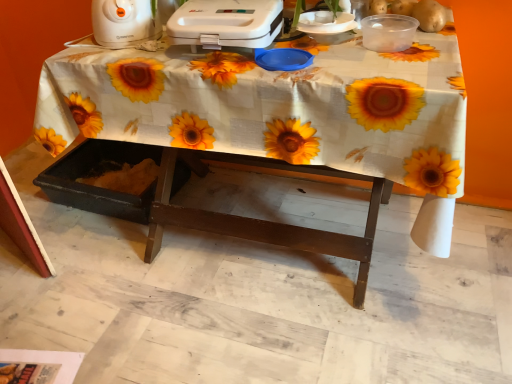
Consider the image. What is the approximate height of white fabric-covered table at center?

The height of white fabric-covered table at center is 26.38 inches.

The width and height of the screenshot is (512, 384). I want to click on white plastic toaster at upper left, positioned as the first appliance in left-to-right order, so click(123, 23).

Where is `white plastic toaster at upper center, the 1th appliance in the right-to-left sequence`? The height and width of the screenshot is (384, 512). white plastic toaster at upper center, the 1th appliance in the right-to-left sequence is located at coordinates 226,23.

From the image's perspective, would you say white plastic toaster at upper center, which is the 2th appliance from left to right, is positioned over white plastic toaster at upper left, positioned as the first appliance in left-to-right order?

No.

Considering the sizes of white plastic toaster at upper center, the 1th appliance in the right-to-left sequence, and white plastic toaster at upper left, positioned as the first appliance in left-to-right order, in the image, is white plastic toaster at upper center, the 1th appliance in the right-to-left sequence, taller or shorter than white plastic toaster at upper left, positioned as the first appliance in left-to-right order,?

white plastic toaster at upper center, the 1th appliance in the right-to-left sequence, is shorter than white plastic toaster at upper left, positioned as the first appliance in left-to-right order.

Is white plastic toaster at upper center, which is the 2th appliance from left to right, closer to camera compared to white plastic toaster at upper left, arranged as the 2th appliance when viewed from the right?

Yes, the depth of white plastic toaster at upper center, which is the 2th appliance from left to right, is less than that of white plastic toaster at upper left, arranged as the 2th appliance when viewed from the right.

Are white plastic toaster at upper center, which is the 2th appliance from left to right, and white plastic toaster at upper left, positioned as the first appliance in left-to-right order, located far from each other?

They are positioned close to each other.

Is the depth of white plastic toaster at upper left, positioned as the first appliance in left-to-right order, greater than that of white plastic toaster at upper center, which is the 2th appliance from left to right?

Yes, it is behind white plastic toaster at upper center, which is the 2th appliance from left to right.

Is point (134, 41) positioned behind point (234, 46)?

Yes, point (134, 41) is behind point (234, 46).

How much distance is there between white plastic toaster at upper left, arranged as the 2th appliance when viewed from the right, and white plastic toaster at upper center, which is the 2th appliance from left to right?

white plastic toaster at upper left, arranged as the 2th appliance when viewed from the right, and white plastic toaster at upper center, which is the 2th appliance from left to right, are 7.42 inches apart from each other.

Can you see white plastic toaster at upper left, arranged as the 2th appliance when viewed from the right, touching white plastic toaster at upper center, which is the 2th appliance from left to right?

There is a gap between white plastic toaster at upper left, arranged as the 2th appliance when viewed from the right, and white plastic toaster at upper center, which is the 2th appliance from left to right.

Is white fabric-covered table at center closer to the viewer compared to white plastic toaster at upper center, the 1th appliance in the right-to-left sequence?

Yes, it is.

From a real-world perspective, between white fabric-covered table at center and white plastic toaster at upper center, the 1th appliance in the right-to-left sequence, who is vertically higher?

white plastic toaster at upper center, the 1th appliance in the right-to-left sequence, from a real-world perspective.

Is white fabric-covered table at center beside white plastic toaster at upper center, which is the 2th appliance from left to right?

No, white fabric-covered table at center is not with white plastic toaster at upper center, which is the 2th appliance from left to right.

In terms of width, does white plastic toaster at upper center, the 1th appliance in the right-to-left sequence, look wider or thinner when compared to white fabric-covered table at center?

In the image, white plastic toaster at upper center, the 1th appliance in the right-to-left sequence, appears to be more narrow than white fabric-covered table at center.

Is white plastic toaster at upper center, the 1th appliance in the right-to-left sequence, placed right next to white fabric-covered table at center?

white plastic toaster at upper center, the 1th appliance in the right-to-left sequence, is not next to white fabric-covered table at center, and they're not touching.

Which of these two, white plastic toaster at upper center, the 1th appliance in the right-to-left sequence, or white fabric-covered table at center, stands shorter?

white plastic toaster at upper center, the 1th appliance in the right-to-left sequence, is shorter.

Which object is positioned more to the right, white plastic toaster at upper center, the 1th appliance in the right-to-left sequence, or white fabric-covered table at center?

Positioned to the right is white fabric-covered table at center.

Does white plastic toaster at upper left, positioned as the first appliance in left-to-right order, appear on the left side of white fabric-covered table at center?

Yes, white plastic toaster at upper left, positioned as the first appliance in left-to-right order, is to the left of white fabric-covered table at center.

Between white plastic toaster at upper left, arranged as the 2th appliance when viewed from the right, and white fabric-covered table at center, which one has smaller width?

With smaller width is white plastic toaster at upper left, arranged as the 2th appliance when viewed from the right.

Is white plastic toaster at upper left, arranged as the 2th appliance when viewed from the right, facing towards white fabric-covered table at center?

No, white plastic toaster at upper left, arranged as the 2th appliance when viewed from the right, is not oriented towards white fabric-covered table at center.

Looking at the image, does white plastic toaster at upper left, arranged as the 2th appliance when viewed from the right, seem bigger or smaller compared to white fabric-covered table at center?

white plastic toaster at upper left, arranged as the 2th appliance when viewed from the right, is smaller than white fabric-covered table at center.

From the image's perspective, who appears lower, white fabric-covered table at center or white plastic toaster at upper left, positioned as the first appliance in left-to-right order?

white fabric-covered table at center appears lower in the image.

Is white fabric-covered table at center wider or thinner than white plastic toaster at upper left, arranged as the 2th appliance when viewed from the right?

white fabric-covered table at center is wider than white plastic toaster at upper left, arranged as the 2th appliance when viewed from the right.

Is white fabric-covered table at center turned away from white plastic toaster at upper left, positioned as the first appliance in left-to-right order?

white fabric-covered table at center is not turned away from white plastic toaster at upper left, positioned as the first appliance in left-to-right order.

Is point (110, 60) less distant than point (124, 11)?

Yes.

Locate an element on the screen. The image size is (512, 384). appliance above the white plastic toaster at upper center, which is the 2th appliance from left to right (from a real-world perspective) is located at coordinates (123, 23).

This screenshot has height=384, width=512. What are the coordinates of `appliance lying in front of the white plastic toaster at upper left, arranged as the 2th appliance when viewed from the right` in the screenshot? It's located at (226, 23).

When comparing their distances from white fabric-covered table at center, does white plastic toaster at upper left, positioned as the first appliance in left-to-right order, or white plastic toaster at upper center, the 1th appliance in the right-to-left sequence, seem further?

white plastic toaster at upper left, positioned as the first appliance in left-to-right order, is further to white fabric-covered table at center.

When comparing their distances from white plastic toaster at upper center, which is the 2th appliance from left to right, does white fabric-covered table at center or white plastic toaster at upper left, positioned as the first appliance in left-to-right order, seem further?

white plastic toaster at upper left, positioned as the first appliance in left-to-right order, is further to white plastic toaster at upper center, which is the 2th appliance from left to right.

Considering their positions, is white fabric-covered table at center positioned closer to white plastic toaster at upper left, positioned as the first appliance in left-to-right order, than white plastic toaster at upper center, which is the 2th appliance from left to right?

white plastic toaster at upper center, which is the 2th appliance from left to right, is closer to white plastic toaster at upper left, positioned as the first appliance in left-to-right order.

Based on the photo, based on their spatial positions, is white plastic toaster at upper center, the 1th appliance in the right-to-left sequence, or white fabric-covered table at center closer to white plastic toaster at upper left, positioned as the first appliance in left-to-right order?

white plastic toaster at upper center, the 1th appliance in the right-to-left sequence, is positioned closer to the anchor white plastic toaster at upper left, positioned as the first appliance in left-to-right order.

From the image, which object appears to be farther from white fabric-covered table at center, white plastic toaster at upper center, the 1th appliance in the right-to-left sequence, or white plastic toaster at upper left, arranged as the 2th appliance when viewed from the right?

white plastic toaster at upper left, arranged as the 2th appliance when viewed from the right, lies further to white fabric-covered table at center than the other object.

Looking at the image, which one is located further to white plastic toaster at upper center, which is the 2th appliance from left to right, white plastic toaster at upper left, arranged as the 2th appliance when viewed from the right, or white fabric-covered table at center?

white plastic toaster at upper left, arranged as the 2th appliance when viewed from the right, is positioned further to the anchor white plastic toaster at upper center, which is the 2th appliance from left to right.

Locate an element on the screen. appliance between white plastic toaster at upper left, arranged as the 2th appliance when viewed from the right, and white fabric-covered table at center from left to right is located at coordinates (226, 23).